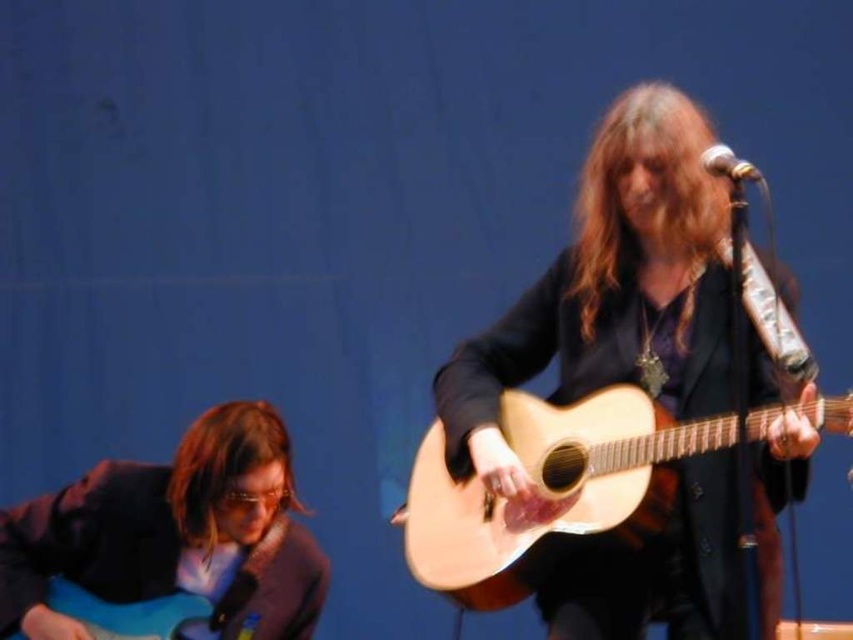
Question: Does natural wood guitar at center appear over natural wood acoustic guitar at center?

Choices:
 (A) no
 (B) yes

Answer: (B)

Question: Which of the following is the closest to the observer?

Choices:
 (A) (639, 211)
 (B) (231, 416)
 (C) (175, 454)

Answer: (A)

Question: Which of the following is the closest to the observer?

Choices:
 (A) brown matte hair at lower left
 (B) natural wood guitar at center

Answer: (B)

Question: Which point appears closest to the camera in this image?

Choices:
 (A) (610, 522)
 (B) (254, 449)

Answer: (A)

Question: Is natural wood acoustic guitar at center bigger than brown matte hair at lower left?

Choices:
 (A) no
 (B) yes

Answer: (B)

Question: Can you confirm if natural wood guitar at center is thinner than natural wood acoustic guitar at center?

Choices:
 (A) yes
 (B) no

Answer: (A)